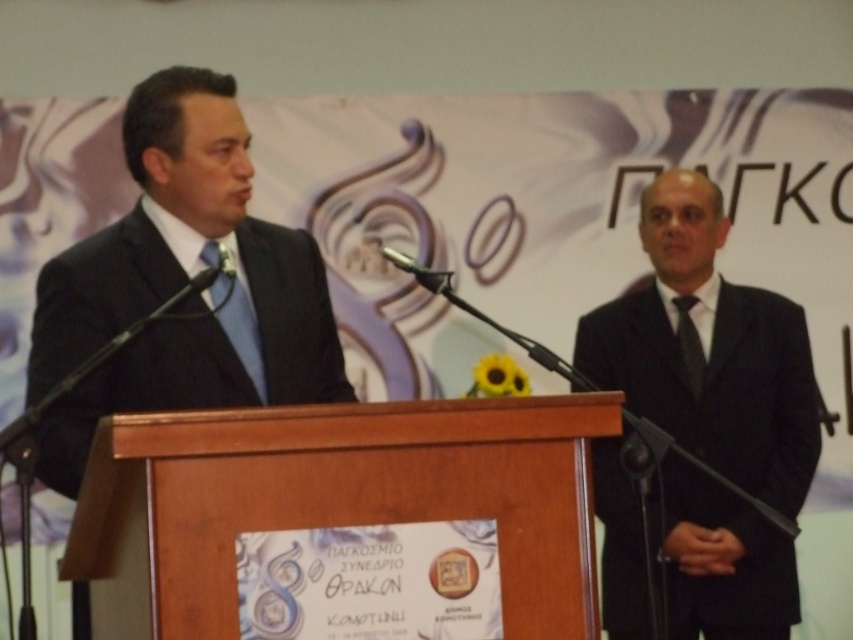
Can you confirm if black textured suit at left is bigger than black textured tie at right?

Correct, black textured suit at left is larger in size than black textured tie at right.

Who is more forward, [212,209] or [676,305]?

Positioned in front is point [212,209].

Is point (51, 468) closer to viewer compared to point (689, 387)?

Yes, it is in front of point (689, 387).

The width and height of the screenshot is (853, 640). Identify the location of black textured suit at left. (180, 284).

Identify the location of dark gray suit at center. (709, 349).

Which is more to the right, dark gray suit at center or metallic at left?

dark gray suit at center

What are the coordinates of `dark gray suit at center` in the screenshot? It's located at (709, 349).

Is dark gray suit at center behind black textured suit at left?

Yes.

Does dark gray suit at center appear over black textured suit at left?

Incorrect, dark gray suit at center is not positioned above black textured suit at left.

Identify the location of dark gray suit at center. This screenshot has height=640, width=853. (709, 349).

Image resolution: width=853 pixels, height=640 pixels. What are the coordinates of `dark gray suit at center` in the screenshot? It's located at (709, 349).